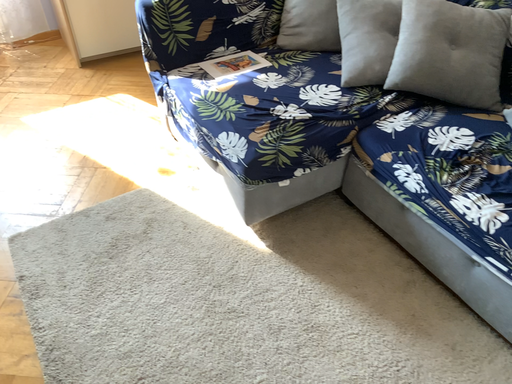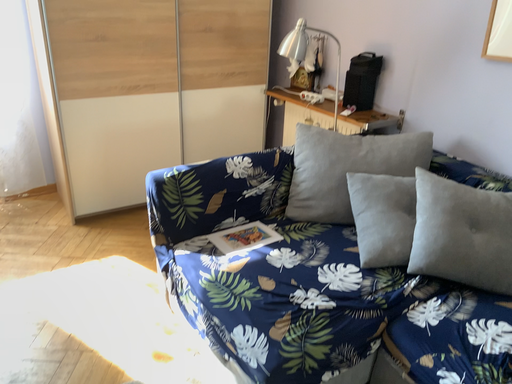
Question: How did the camera likely rotate when shooting the video?

Choices:
 (A) rotated downward
 (B) rotated upward

Answer: (B)